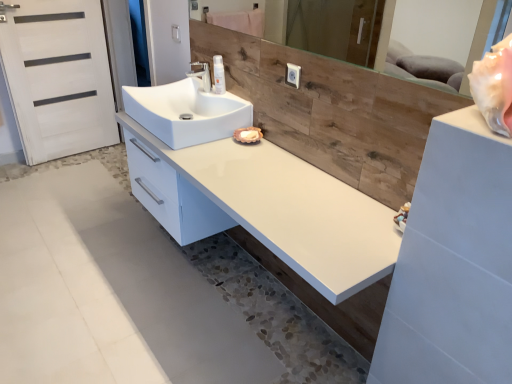
The height and width of the screenshot is (384, 512). What do you see at coordinates (187, 110) in the screenshot?
I see `white glossy sink at center` at bounding box center [187, 110].

The width and height of the screenshot is (512, 384). What do you see at coordinates (438, 28) in the screenshot?
I see `wooden mirror at upper center` at bounding box center [438, 28].

Locate an element on the screen. The height and width of the screenshot is (384, 512). wooden mirror at upper center is located at coordinates (438, 28).

Identify the location of white glossy spray can at center. This screenshot has height=384, width=512. (218, 75).

Identify the location of white glossy sink at center. (187, 110).

Would you say white glossy spray can at center contains white matte door at left?

No, white matte door at left is not a part of white glossy spray can at center.

From a real-world perspective, which is physically below, white glossy spray can at center or white matte door at left?

In real-world perspective, white matte door at left is lower.

Does white glossy spray can at center lie behind white matte door at left?

No, it is not.

From the picture: Would you say white glossy spray can at center is a long distance from white matte door at left?

white glossy spray can at center is far away from white matte door at left.

Between white glossy counter at center and white glossy faucet at center, which one has larger size?

With larger size is white glossy counter at center.

Measure the distance between white glossy counter at center and white glossy faucet at center.

They are 31.30 inches apart.

Is white glossy counter at center to the right of white glossy faucet at center from the viewer's perspective?

Indeed, white glossy counter at center is positioned on the right side of white glossy faucet at center.

Is point (219, 76) in front of point (203, 5)?

Yes, point (219, 76) is in front of point (203, 5).

Is white glossy spray can at center in front of wooden mirror at upper center?

No, the depth of white glossy spray can at center is greater than that of wooden mirror at upper center.

From the image's perspective, is white glossy spray can at center above or below wooden mirror at upper center?

Based on their image positions, white glossy spray can at center is located beneath wooden mirror at upper center.

Which is more to the right, white glossy spray can at center or wooden mirror at upper center?

Positioned to the right is wooden mirror at upper center.

Which object is further away from the camera, white glossy faucet at center or white glossy spray can at center?

white glossy spray can at center is further away from the camera.

Could you tell me if white glossy faucet at center is facing white glossy spray can at center?

No, white glossy faucet at center is not oriented towards white glossy spray can at center.

Can you tell me how much white glossy faucet at center and white glossy spray can at center differ in facing direction?

The angle between the facing direction of white glossy faucet at center and the facing direction of white glossy spray can at center is 2.52 degrees.

Does point (196, 64) appear closer or farther from the camera than point (214, 83)?

Clearly, point (196, 64) is more distant from the camera than point (214, 83).

Is white matte door at left far from white glossy counter at center?

white matte door at left is positioned a significant distance from white glossy counter at center.

From the image's perspective, is white matte door at left on top of white glossy counter at center?

Indeed, from the image's perspective, white matte door at left is shown above white glossy counter at center.

I want to click on screen door above the white glossy counter at center (from the image's perspective), so click(58, 77).

Considering the relative sizes of white matte door at left and white glossy counter at center in the image provided, is white matte door at left smaller than white glossy counter at center?

Correct, white matte door at left occupies less space than white glossy counter at center.

Can you confirm if wooden mirror at upper center is wider than white glossy faucet at center?

No.

Is wooden mirror at upper center looking in the opposite direction of white glossy faucet at center?

wooden mirror at upper center does not have its back to white glossy faucet at center.

From a real-world perspective, between wooden mirror at upper center and white glossy sink at center, who is vertically higher?

wooden mirror at upper center is physically above.

Consider the image. Is wooden mirror at upper center further to the viewer compared to white glossy sink at center?

That is False.

Can you confirm if wooden mirror at upper center is smaller than white glossy sink at center?

Indeed, wooden mirror at upper center has a smaller size compared to white glossy sink at center.

From the image's perspective, is wooden mirror at upper center on top of white glossy sink at center?

Indeed, from the image's perspective, wooden mirror at upper center is shown above white glossy sink at center.

Image resolution: width=512 pixels, height=384 pixels. In order to click on screen door behind the white glossy spray can at center in this screenshot , I will do pos(58,77).

At what (x,y) coordinates should I click in order to perform the action: click on counter that is below the white glossy faucet at center (from the image's perspective). Please return your answer as a coordinate pair (x, y). Looking at the image, I should click on (298, 226).

In the scene shown: Looking at the image, which one is located further to white matte door at left, white glossy faucet at center or white glossy spray can at center?

The object further to white matte door at left is white glossy spray can at center.

In the scene shown: When comparing their distances from white matte door at left, does wooden mirror at upper center or white glossy faucet at center seem closer?

white glossy faucet at center is closer to white matte door at left.

Estimate the real-world distances between objects in this image. Which object is further from wooden mirror at upper center, white glossy spray can at center or white glossy counter at center?

The object further to wooden mirror at upper center is white glossy counter at center.

Estimate the real-world distances between objects in this image. Which object is further from white glossy faucet at center, wooden mirror at upper center or white matte door at left?

wooden mirror at upper center is further to white glossy faucet at center.

Based on their spatial positions, is white glossy counter at center or wooden mirror at upper center closer to white glossy faucet at center?

white glossy counter at center.

Looking at the image, which one is located closer to white glossy sink at center, white matte door at left or white glossy faucet at center?

white glossy faucet at center is closer to white glossy sink at center.

When comparing their distances from white glossy faucet at center, does white glossy sink at center or white glossy spray can at center seem closer?

Based on the image, white glossy spray can at center appears to be nearer to white glossy faucet at center.

Estimate the real-world distances between objects in this image. Which object is closer to white glossy faucet at center, white matte door at left or white glossy spray can at center?

white glossy spray can at center is closer to white glossy faucet at center.

The height and width of the screenshot is (384, 512). Identify the location of counter between wooden mirror at upper center and white glossy spray can at center along the z-axis. (298, 226).

Locate an element on the screen. This screenshot has width=512, height=384. tap located between white glossy sink at center and white glossy spray can at center in the depth direction is located at coordinates (202, 75).

Locate an element on the screen. This screenshot has width=512, height=384. sink positioned between wooden mirror at upper center and white glossy spray can at center from near to far is located at coordinates (187, 110).

The height and width of the screenshot is (384, 512). What are the coordinates of `tap between white matte door at left and white glossy spray can at center in the horizontal direction` in the screenshot? It's located at (202, 75).